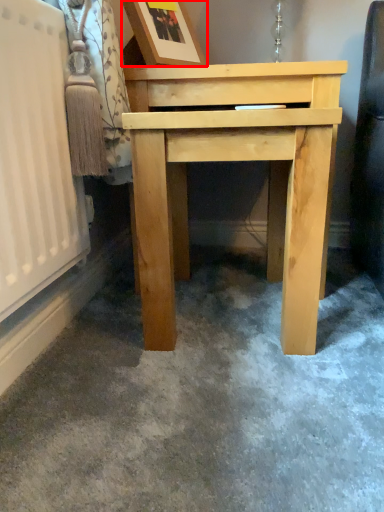
Question: From the image's perspective, what is the correct spatial relationship of picture frame (annotated by the red box) in relation to table?

Choices:
 (A) below
 (B) above

Answer: (B)